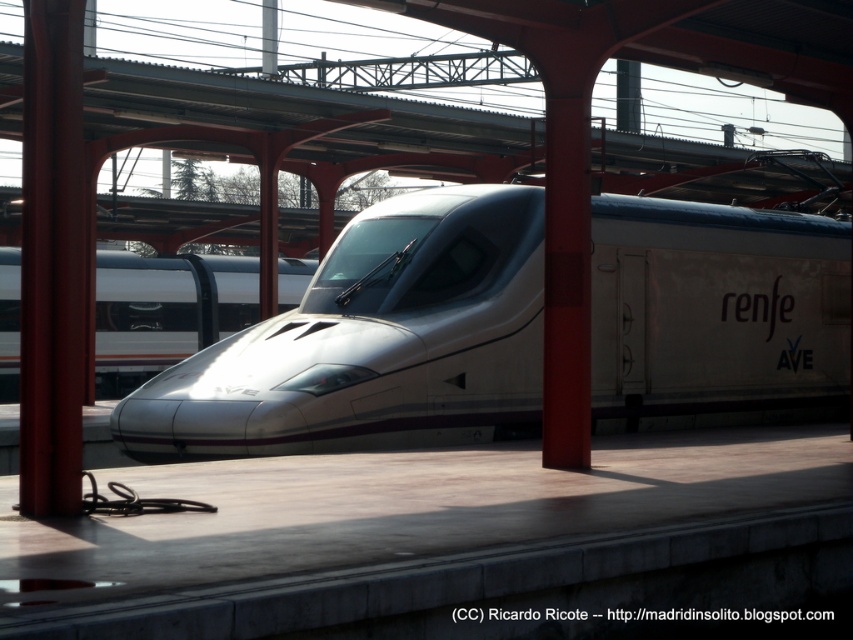
Is point (463, 192) positioned behind point (100, 291)?

No, (463, 192) is in front of (100, 291).

Is sleek silver train at center taller than white glossy train at center?

Yes.

This screenshot has height=640, width=853. What are the coordinates of `sleek silver train at center` in the screenshot? It's located at (372, 342).